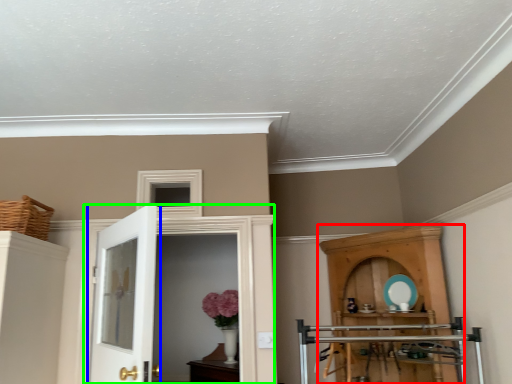
Question: Estimate the real-world distances between objects in this image. Which object is closer to cupboard (highlighted by a red box), door (highlighted by a blue box) or door (highlighted by a green box)?

Choices:
 (A) door
 (B) door

Answer: (B)